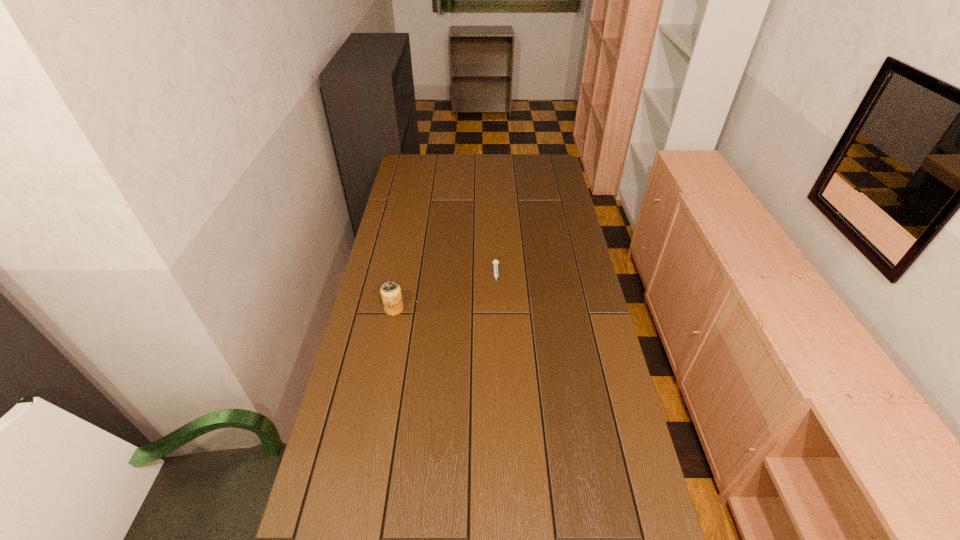
The width and height of the screenshot is (960, 540). What are the coordinates of `the left object` in the screenshot? It's located at [390, 291].

You are a GUI agent. You are given a task and a screenshot of the screen. Output one action in this format:
    pyautogui.click(x=<x>, y=<y>)
    Task: Click on the beer can
    The image size is (960, 540).
    Given the screenshot: What is the action you would take?
    pyautogui.click(x=390, y=291)

Where is `the shorter object`? the shorter object is located at coordinates (495, 262).

The width and height of the screenshot is (960, 540). I want to click on the right object, so click(495, 262).

The image size is (960, 540). Identify the location of free space located on the front of the taller object. tap(380, 378).

Locate an element on the screen. Image resolution: width=960 pixels, height=540 pixels. free space located at the needle end of the farther object is located at coordinates (500, 381).

At what (x,y) coordinates should I click in order to perform the action: click on object that is at the left edge. Please return your answer as a coordinate pair (x, y). The width and height of the screenshot is (960, 540). Looking at the image, I should click on (390, 291).

The height and width of the screenshot is (540, 960). In the image, there is a desktop. Identify the location of vacant space at the far edge. (468, 167).

At what (x,y) coordinates should I click in order to perform the action: click on vacant area at the left edge. Please return your answer as a coordinate pair (x, y). Image resolution: width=960 pixels, height=540 pixels. Looking at the image, I should click on (376, 408).

The width and height of the screenshot is (960, 540). In the image, there is a desktop. What are the coordinates of `free region at the right edge` in the screenshot? It's located at pyautogui.click(x=586, y=332).